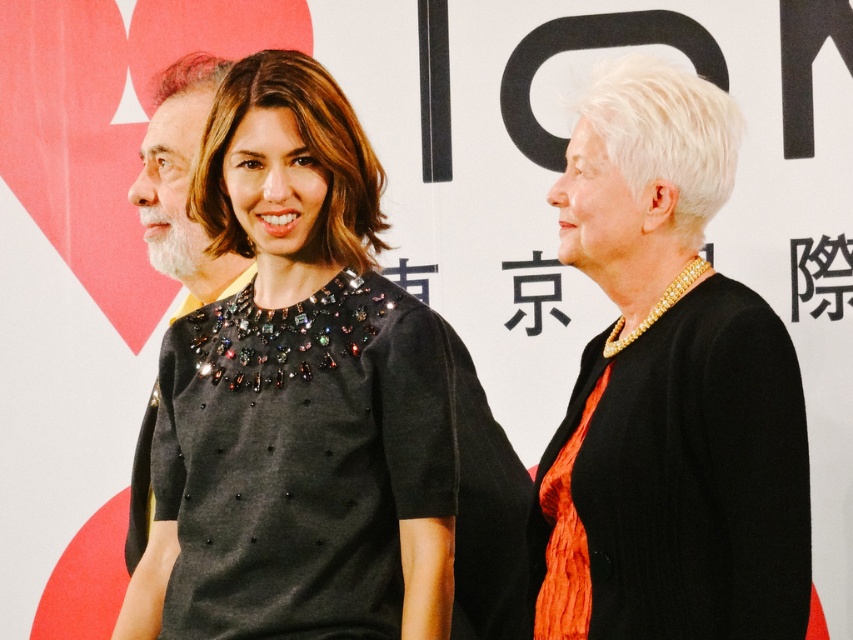
Is black beaded dress at center further to camera compared to gray textured hair at left?

That is False.

Which is behind, point (207, 548) or point (170, 260)?

The point (170, 260) is behind.

Which is behind, point (332, 468) or point (178, 188)?

Point (178, 188)

Where is `black beaded dress at center`? The width and height of the screenshot is (853, 640). black beaded dress at center is located at coordinates (299, 396).

Who is positioned more to the right, black beaded dress at center or matte black dress at right?

matte black dress at right is more to the right.

Is black beaded dress at center wider than matte black dress at right?

Yes, black beaded dress at center is wider than matte black dress at right.

From the picture: Who is more forward, (392, 582) or (674, 600)?

Point (674, 600) is more forward.

Find the location of `black beaded dress at center`. black beaded dress at center is located at coordinates (299, 396).

Based on the photo, can you confirm if matte black dress at right is positioned to the right of gray textured hair at left?

Yes, matte black dress at right is to the right of gray textured hair at left.

Does point (599, 500) come in front of point (173, 173)?

That is True.

Between point (637, 141) and point (189, 177), which one is positioned behind?

The point (189, 177) is behind.

This screenshot has height=640, width=853. What are the coordinates of `matte black dress at right` in the screenshot? It's located at (668, 392).